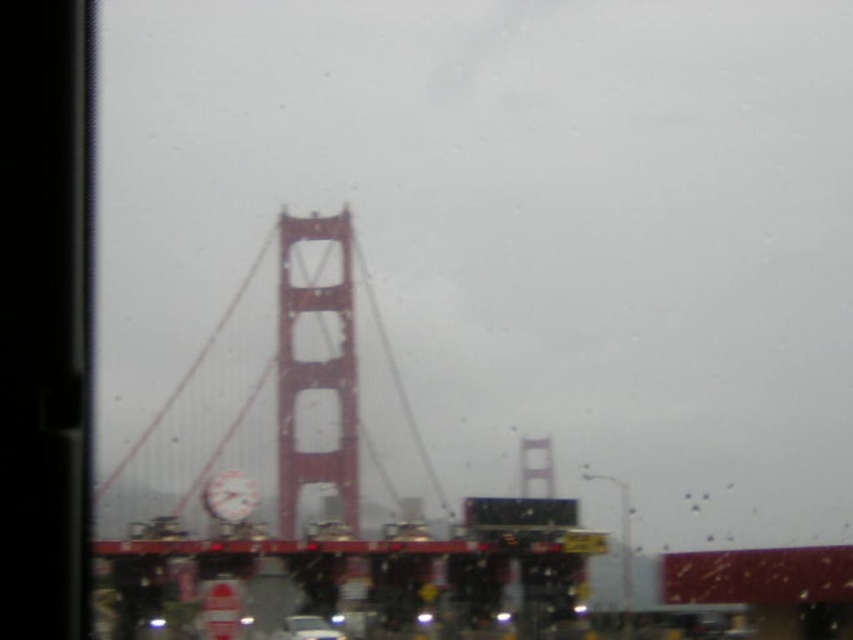
Between metallic red suspension bridge at center and metallic silver car at center, which one is positioned higher?

metallic red suspension bridge at center

In the scene shown: Does metallic red suspension bridge at center appear on the right side of metallic silver car at center?

Yes, metallic red suspension bridge at center is to the right of metallic silver car at center.

Who is more forward, (227, 372) or (292, 632)?

Point (292, 632)

Where is `metallic red suspension bridge at center`? This screenshot has width=853, height=640. metallic red suspension bridge at center is located at coordinates (317, 484).